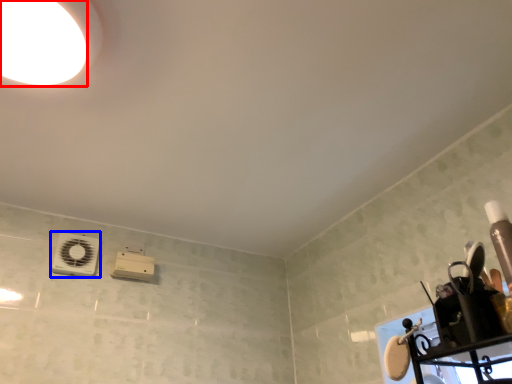
Question: Which of the following is the farthest to the observer, droplight (highlighted by a red box) or appliance (highlighted by a blue box)?

Choices:
 (A) droplight
 (B) appliance

Answer: (B)